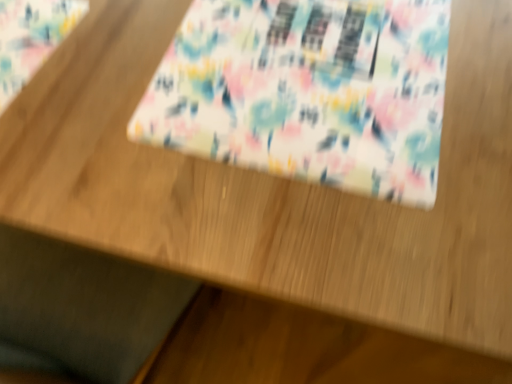
The image size is (512, 384). Describe the element at coordinates (308, 92) in the screenshot. I see `floral fabric blanket at center` at that location.

Measure the distance between point (x=352, y=87) and camera.

They are 19.25 inches apart.

Where is `floral fabric blanket at center`? The height and width of the screenshot is (384, 512). floral fabric blanket at center is located at coordinates (308, 92).

The width and height of the screenshot is (512, 384). Identify the location of floral fabric blanket at center. (308, 92).